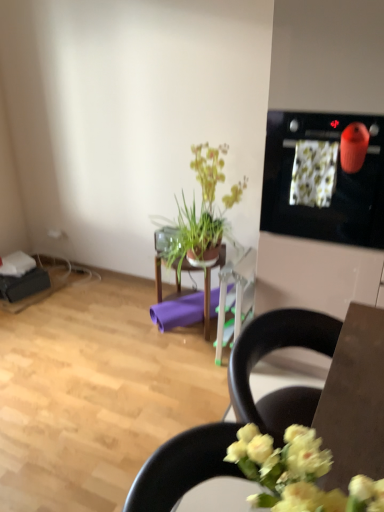
The height and width of the screenshot is (512, 384). Describe the element at coordinates (250, 471) in the screenshot. I see `black plastic chair at lower right` at that location.

The image size is (384, 512). Describe the element at coordinates (161, 263) in the screenshot. I see `wooden table at center` at that location.

Describe the element at coordinates (202, 212) in the screenshot. I see `green leafy plant at center` at that location.

Where is `black plastic chair at lower right`? black plastic chair at lower right is located at coordinates (250, 471).

Is black plastic chair at lower right positioned with its back to green leafy plant at center?

That's not correct — black plastic chair at lower right is not looking away from green leafy plant at center.

Considering the sizes of objects black plastic chair at lower right and green leafy plant at center in the image provided, who is taller, black plastic chair at lower right or green leafy plant at center?

With more height is green leafy plant at center.

Considering the positions of objects black plastic chair at lower right and green leafy plant at center in the image provided, who is more to the left, black plastic chair at lower right or green leafy plant at center?

Positioned to the left is black plastic chair at lower right.

From the image's perspective, would you say black plastic chair at lower right is shown under green leafy plant at center?

Indeed, from the image's perspective, black plastic chair at lower right is shown beneath green leafy plant at center.

From the image's perspective, which is above, purple matte yoga mat at center or wooden table at center?

wooden table at center, from the image's perspective.

Considering the relative positions of purple matte yoga mat at center and wooden table at center in the image provided, is purple matte yoga mat at center to the left of wooden table at center from the viewer's perspective?

No.

From a real-world perspective, is purple matte yoga mat at center located beneath wooden table at center?

Indeed, from a real-world perspective, purple matte yoga mat at center is positioned beneath wooden table at center.

Based on the photo, would you say green leafy plant at center is a long distance from black glossy oven at upper right?

No, green leafy plant at center is in close proximity to black glossy oven at upper right.

Between point (179, 220) and point (283, 196), which one is positioned behind?

The point (179, 220) is farther from the camera.

Is green leafy plant at center taller than black glossy oven at upper right?

Correct, green leafy plant at center is much taller as black glossy oven at upper right.

Image resolution: width=384 pixels, height=512 pixels. Identify the location of houseplant lying in front of the purple matte yoga mat at center. (202, 212).

Measure the distance from green leafy plant at center to purple matte yoga mat at center.

green leafy plant at center is 17.03 inches from purple matte yoga mat at center.

Would you consider green leafy plant at center to be distant from purple matte yoga mat at center?

green leafy plant at center is near purple matte yoga mat at center, not far away.

Between wooden table at center and black plastic chair at lower right, which one has smaller size?

black plastic chair at lower right.

Can you confirm if wooden table at center is wider than black plastic chair at lower right?

No, wooden table at center is not wider than black plastic chair at lower right.

Which object is further away from the camera, wooden table at center or black plastic chair at lower right?

wooden table at center is more distant.

Considering the positions of objects wooden table at center and black plastic chair at lower right in the image provided, who is more to the right, wooden table at center or black plastic chair at lower right?

black plastic chair at lower right.

Consider the image. Choose the correct answer: Is wooden table at center inside black glossy oven at upper right or outside it?

The correct answer is: outside.

Based on the photo, is wooden table at center oriented towards black glossy oven at upper right?

No, wooden table at center is not aimed at black glossy oven at upper right.

From the image's perspective, who appears lower, wooden table at center or black glossy oven at upper right?

wooden table at center appears lower in the image.

Considering the relative sizes of wooden table at center and black glossy oven at upper right in the image provided, is wooden table at center wider than black glossy oven at upper right?

No, wooden table at center is not wider than black glossy oven at upper right.

Is black glossy oven at upper right inside the boundaries of green leafy plant at center, or outside?

black glossy oven at upper right lies outside green leafy plant at center.

From the image's perspective, is black glossy oven at upper right positioned above or below green leafy plant at center?

From the image's perspective, black glossy oven at upper right appears above green leafy plant at center.

How distant is black glossy oven at upper right from green leafy plant at center?

The distance of black glossy oven at upper right from green leafy plant at center is 65.17 centimeters.

Can you confirm if black glossy oven at upper right is smaller than green leafy plant at center?

No, black glossy oven at upper right is not smaller than green leafy plant at center.

At what (x,y) coordinates should I click in order to perform the action: click on chair below the green leafy plant at center (from the image's perspective). Please return your answer as a coordinate pair (x, y). The width and height of the screenshot is (384, 512). Looking at the image, I should click on (250, 471).

At what (x,y) coordinates should I click in order to perform the action: click on table positioned vertically above the purple matte yoga mat at center (from a real-world perspective). Please return your answer as a coordinate pair (x, y). Image resolution: width=384 pixels, height=512 pixels. Looking at the image, I should click on (161, 263).

Considering their positions, is purple matte yoga mat at center positioned closer to green leafy plant at center than black glossy oven at upper right?

Based on the image, purple matte yoga mat at center appears to be nearer to green leafy plant at center.

From the image, which object appears to be nearer to purple matte yoga mat at center, black glossy oven at upper right or green leafy plant at center?

green leafy plant at center lies closer to purple matte yoga mat at center than the other object.

Looking at the image, which one is located closer to wooden table at center, black glossy oven at upper right or black plastic chair at lower right?

Among the two, black glossy oven at upper right is located nearer to wooden table at center.

Based on their spatial positions, is black plastic chair at lower right or purple matte yoga mat at center closer to green leafy plant at center?

purple matte yoga mat at center is positioned closer to the anchor green leafy plant at center.

Estimate the real-world distances between objects in this image. Which object is closer to black glossy oven at upper right, wooden table at center or black plastic chair at lower right?

wooden table at center lies closer to black glossy oven at upper right than the other object.

Estimate the real-world distances between objects in this image. Which object is further from purple matte yoga mat at center, green leafy plant at center or black plastic chair at lower right?

black plastic chair at lower right is further to purple matte yoga mat at center.

Which object lies nearer to the anchor point purple matte yoga mat at center, black plastic chair at lower right or black glossy oven at upper right?

black glossy oven at upper right lies closer to purple matte yoga mat at center than the other object.

When comparing their distances from green leafy plant at center, does purple matte yoga mat at center or black plastic chair at lower right seem closer?

The object closer to green leafy plant at center is purple matte yoga mat at center.

The image size is (384, 512). In order to click on houseplant located between black plastic chair at lower right and purple matte yoga mat at center in the depth direction in this screenshot , I will do `click(202, 212)`.

Identify the location of table located between black plastic chair at lower right and purple matte yoga mat at center in the depth direction. This screenshot has height=512, width=384. (161, 263).

This screenshot has height=512, width=384. I want to click on houseplant between black glossy oven at upper right and wooden table at center along the z-axis, so click(202, 212).

This screenshot has height=512, width=384. Find the location of `table between black glossy oven at upper right and purple matte yoga mat at center in the front-back direction`. table between black glossy oven at upper right and purple matte yoga mat at center in the front-back direction is located at coordinates (161, 263).